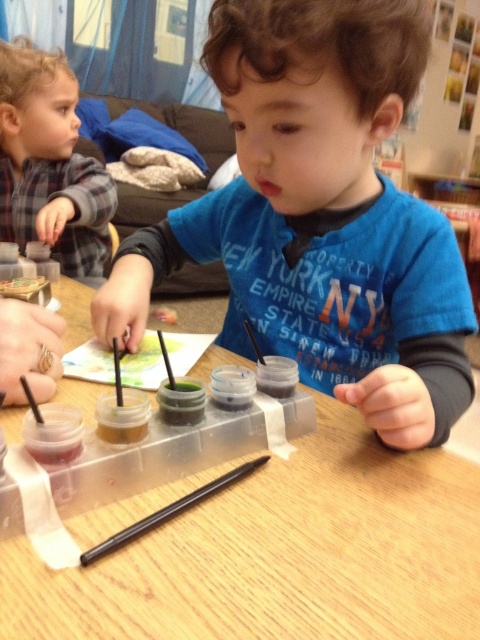
The child wearing the blue matte shirt at center has a paintbrush in their hand and a paint tray in front of them. How far apart are the paintbrush and the paint tray?

The paintbrush and the paint tray are 16.00 inches apart.

You are a parent trying to locate your child who is wearing a plaid flannel shirt at upper left. Based on the scene, where would you find the plaid flaffle shirt at upper left relative to the wooden table at center?

The wooden table at center is in front of the plaid flannel shirt at upper left, so the plaid flannel shirt at upper left is behind the wooden table at center.

You are a painter standing in front of the wooden table at center and the blue matte shirt at center. You need to place a 5.5 inch wide painting on the table without it overlapping the shirt. Is there enough space between them?

The blue matte shirt at center and wooden table at center are 6.08 inches apart from each other. Since the painting is 5.5 inches wide, there is enough space between them to place the painting without overlapping the shirt.